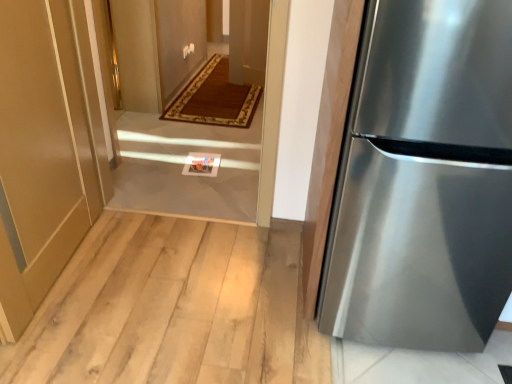
Locate an element on the screen. free space on the front side of matte gold door at lower left is located at coordinates (70, 331).